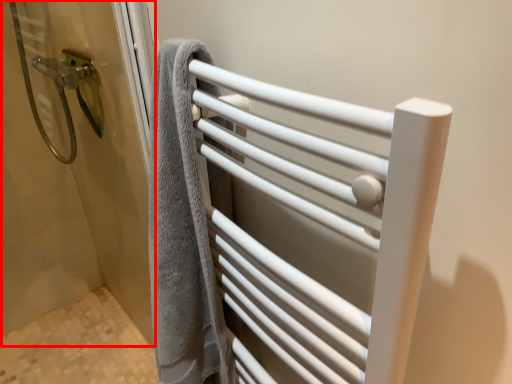
Question: From the image's perspective, what is the correct spatial relationship of screen door (annotated by the red box) in relation to towel rack?

Choices:
 (A) above
 (B) below

Answer: (A)